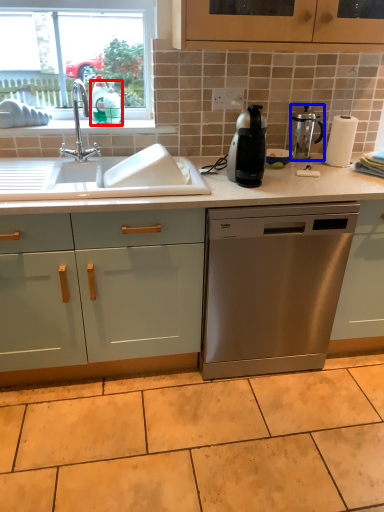
Question: Which point is closer to the camera, teal (highlighted by a red box) or kitchen appliance (highlighted by a blue box)?

Choices:
 (A) teal
 (B) kitchen appliance

Answer: (A)